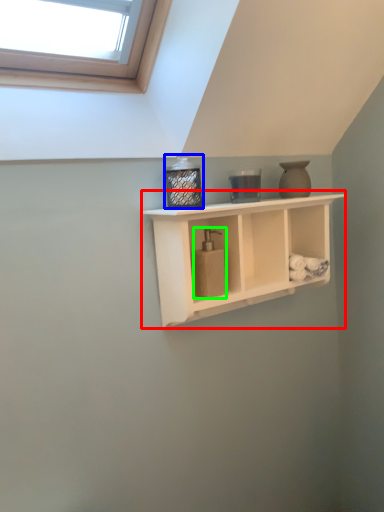
Question: Considering the real-world distances, which object is farthest from shelf (highlighted by a red box)? bottle (highlighted by a blue box) or soap dispenser (highlighted by a green box)?

Choices:
 (A) bottle
 (B) soap dispenser

Answer: (A)